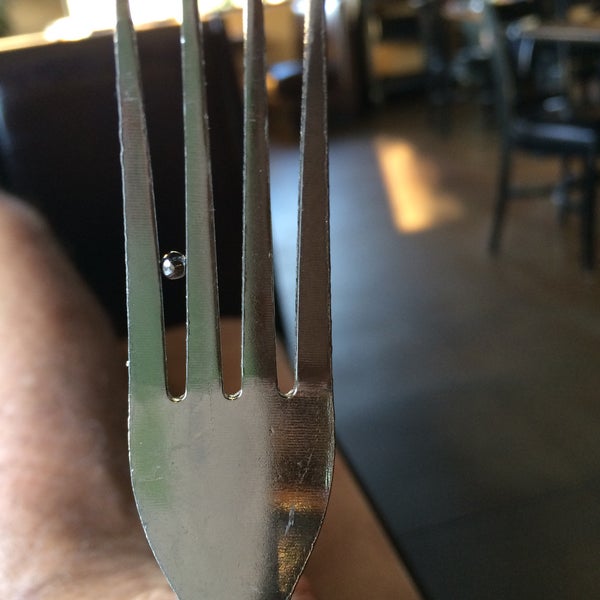
The height and width of the screenshot is (600, 600). Find the location of `fork`. fork is located at coordinates (251, 465).